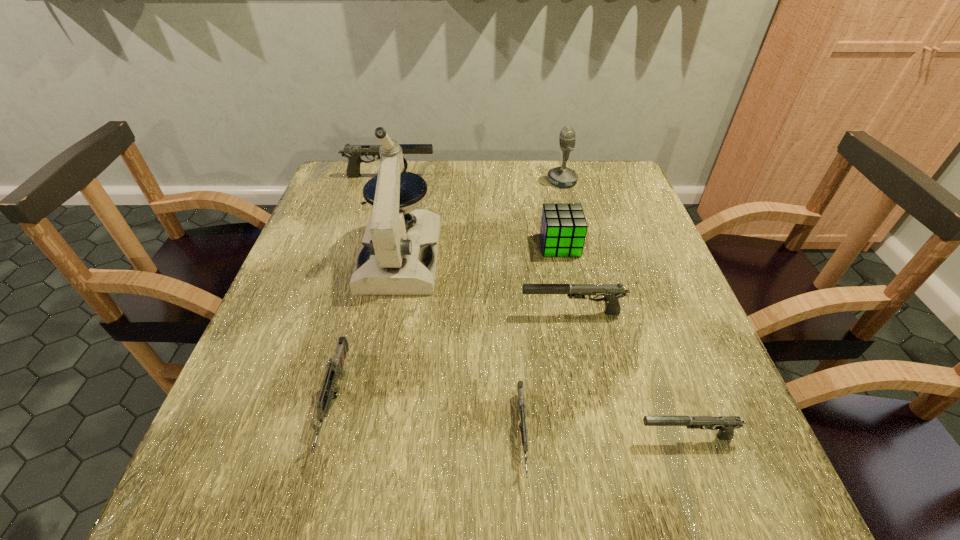
Find the location of a particular element. free area in between the farthest gray gun and the cube is located at coordinates (474, 211).

This screenshot has width=960, height=540. I want to click on vacant space in between the smaller grey gun and the left grey gun, so pyautogui.click(x=429, y=418).

Where is `free spot between the shortest object and the tallest object`? This screenshot has height=540, width=960. free spot between the shortest object and the tallest object is located at coordinates (462, 345).

Find the location of a particular element. This screenshot has width=960, height=540. vacant area between the microphone and the nearest gray gun is located at coordinates (624, 309).

I want to click on vacant area between the right grey gun and the red cube, so click(541, 340).

You are a GUI agent. You are given a task and a screenshot of the screen. Output one action in this format:
    pyautogui.click(x=<x>, y=<y>)
    Task: Click on the vacant region between the left grey gun and the red cube
    
    Given the screenshot: What is the action you would take?
    pyautogui.click(x=447, y=323)

Where is `the third closest object relative to the red cube`? the third closest object relative to the red cube is located at coordinates (393, 260).

Point out which object is positioned as the nearest to the microphone. Please provide its 2D coordinates. Your answer should be formatted as a tuple, i.e. [(x, y)], where the tuple contains the x and y coordinates of a point satisfying the conditions above.

[(563, 228)]

This screenshot has height=540, width=960. Identify the location of the fourth closest gun to the farthest gray gun. (725, 424).

The image size is (960, 540). In order to click on gun that is the fourth nearest to the left grey gun in this screenshot , I will do `click(353, 152)`.